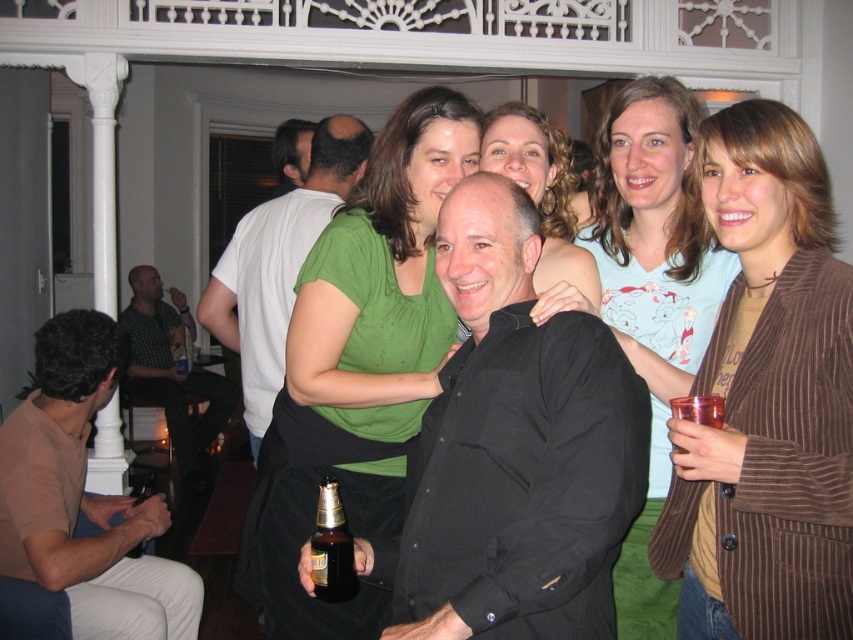
Question: Observing the image, what is the correct spatial positioning of black matte shirt at center in reference to brown glass bottle at center?

Choices:
 (A) above
 (B) below

Answer: (A)

Question: Which of the following is the closest to the observer?

Choices:
 (A) brown glass bottle at center
 (B) matte white shirt at upper left
 (C) checkered fabric shirt at left
 (D) black matte shirt at center

Answer: (D)

Question: Considering the real-world distances, which object is closest to the white matte shirt at center?

Choices:
 (A) matte white shirt at upper left
 (B) brown corduroy blazer at center
 (C) brown cotton shirt at lower left
 (D) green matte shirt at center

Answer: (A)

Question: Estimate the real-world distances between objects in this image. Which object is closer to the brown corduroy blazer at center?

Choices:
 (A) light blue cotton shirt at upper right
 (B) matte white shirt at upper left

Answer: (A)

Question: Observing the image, what is the correct spatial positioning of black matte shirt at center in reference to brown cotton shirt at lower left?

Choices:
 (A) right
 (B) left

Answer: (A)

Question: Can you confirm if white matte shirt at center is smaller than checkered fabric shirt at left?

Choices:
 (A) no
 (B) yes

Answer: (B)